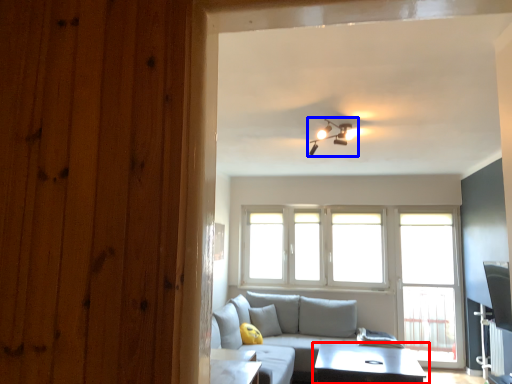
Question: Which of the following is the farthest to the observer, table (highlighted by a red box) or light fixture (highlighted by a blue box)?

Choices:
 (A) table
 (B) light fixture

Answer: (A)